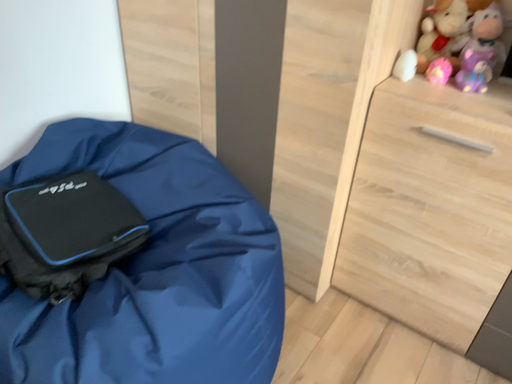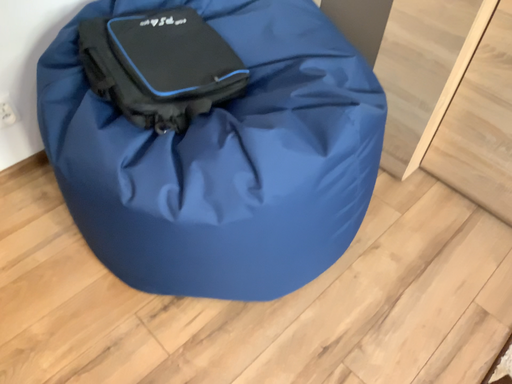
Question: How did the camera likely rotate when shooting the video?

Choices:
 (A) rotated upward
 (B) rotated downward

Answer: (B)